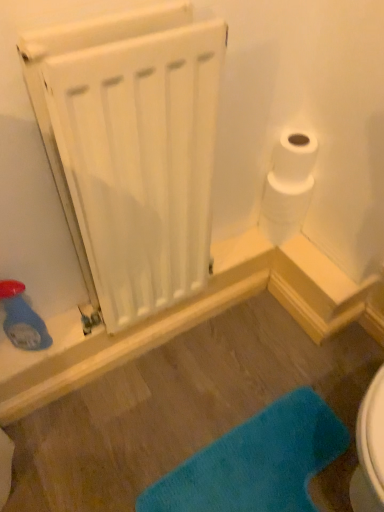
This screenshot has width=384, height=512. In order to click on vacant region to the left of blue fuzzy bath mat at lower center in this screenshot , I will do `click(114, 437)`.